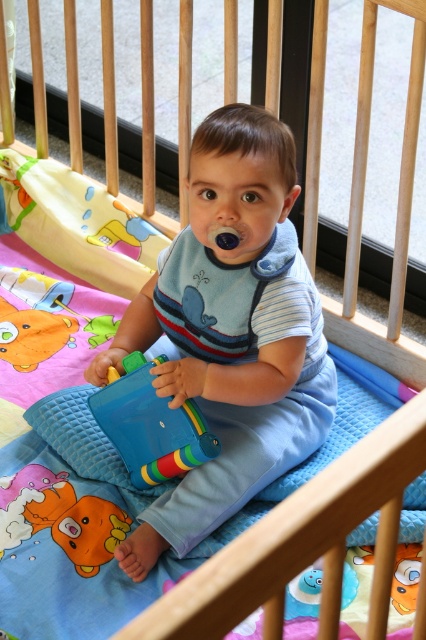
Question: Which point is closer to the camera?

Choices:
 (A) blue matte toy at center
 (B) blue plastic toy at center
 (C) rubber duck at lower left

Answer: (A)

Question: Which object is farther from the camera taking this photo?

Choices:
 (A) blue plastic toy at center
 (B) rubber duck at lower left

Answer: (A)

Question: Does blue matte toy at center have a larger size compared to rubber duck at lower left?

Choices:
 (A) no
 (B) yes

Answer: (B)

Question: Among these objects, which one is nearest to the camera?

Choices:
 (A) rubber duck at lower left
 (B) blue plastic toy at center

Answer: (A)

Question: Is blue matte toy at center above blue plastic toy at center?

Choices:
 (A) no
 (B) yes

Answer: (B)

Question: Does blue plastic toy at center appear on the left side of rubber duck at lower left?

Choices:
 (A) no
 (B) yes

Answer: (A)